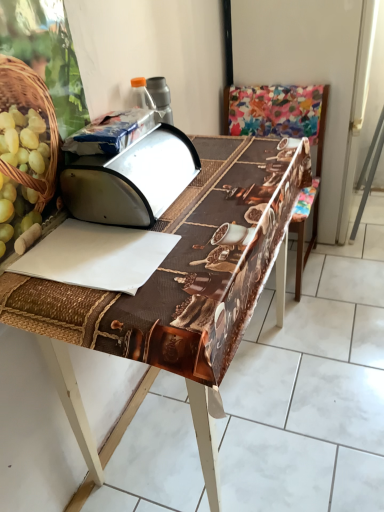
Question: Is multicolored fabric chair at center in front of metallic silver breadbox at center?

Choices:
 (A) no
 (B) yes

Answer: (A)

Question: Does multicolored fabric chair at center have a lesser width compared to metallic silver breadbox at center?

Choices:
 (A) yes
 (B) no

Answer: (B)

Question: From the image's perspective, is multicolored fabric chair at center on top of metallic silver breadbox at center?

Choices:
 (A) yes
 (B) no

Answer: (A)

Question: Considering the relative sizes of multicolored fabric chair at center and metallic silver breadbox at center in the image provided, is multicolored fabric chair at center smaller than metallic silver breadbox at center?

Choices:
 (A) yes
 (B) no

Answer: (B)

Question: Considering the relative sizes of multicolored fabric chair at center and metallic silver breadbox at center in the image provided, is multicolored fabric chair at center wider than metallic silver breadbox at center?

Choices:
 (A) yes
 (B) no

Answer: (A)

Question: Is multicolored fabric chair at center located outside metallic silver breadbox at center?

Choices:
 (A) yes
 (B) no

Answer: (A)

Question: From the image's perspective, is blue plastic bag at upper center, which is the 1th wrapping paper in top-to-bottom order, beneath brown woven table at center?

Choices:
 (A) no
 (B) yes

Answer: (A)

Question: Is blue plastic bag at upper center, which is the 1th wrapping paper in top-to-bottom order, aimed at brown woven table at center?

Choices:
 (A) yes
 (B) no

Answer: (B)

Question: Is blue plastic bag at upper center, positioned as the 2th wrapping paper in bottom-to-top order, completely or partially outside of brown woven table at center?

Choices:
 (A) no
 (B) yes

Answer: (B)

Question: From a real-world perspective, is blue plastic bag at upper center, positioned as the 2th wrapping paper in bottom-to-top order, over brown woven table at center?

Choices:
 (A) yes
 (B) no

Answer: (A)

Question: Is brown woven table at center surrounded by blue plastic bag at upper center, which is the 1th wrapping paper in top-to-bottom order?

Choices:
 (A) yes
 (B) no

Answer: (B)

Question: Is blue plastic bag at upper center, which is the 1th wrapping paper in top-to-bottom order, directly adjacent to brown woven table at center?

Choices:
 (A) no
 (B) yes

Answer: (A)

Question: Is blue plastic bag at upper center, which is the 1th wrapping paper in top-to-bottom order, completely or partially outside of multicolored fabric chair at center?

Choices:
 (A) yes
 (B) no

Answer: (A)